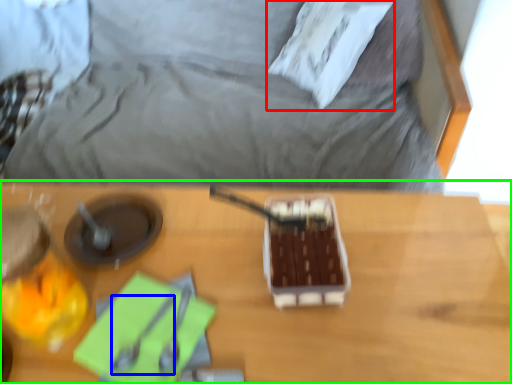
Question: Considering the real-world distances, which object is farthest from pillow (highlighted by a red box)? utensil (highlighted by a blue box) or table (highlighted by a green box)?

Choices:
 (A) utensil
 (B) table

Answer: (A)